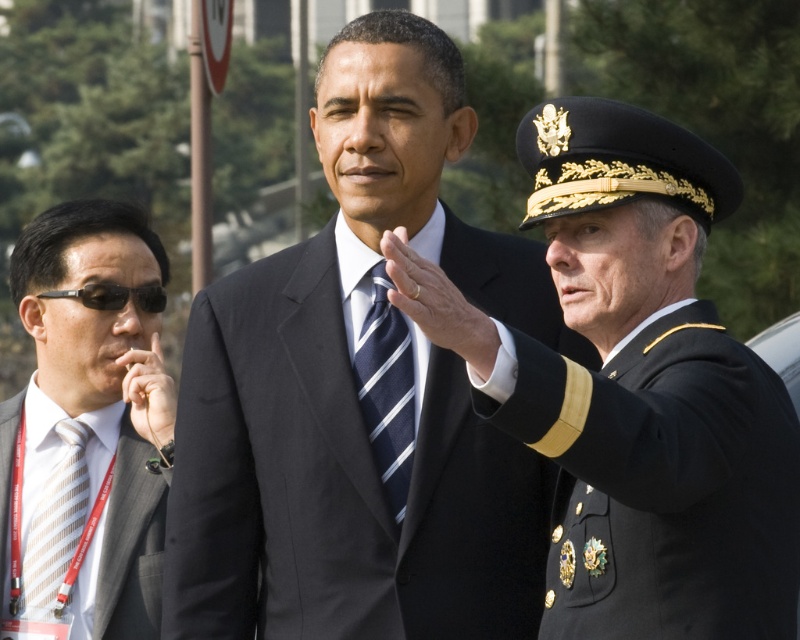
You are a photographer trying to position yourself to capture a photo of the matte black suit at center. According to the coordinates provided, where exactly should you aim your camera?

The matte black suit at center is located at point coordinates (366,388), so aim your camera precisely at those coordinates to capture the subject accurately.

You are a photographer trying to capture a group photo of the black military uniform at right and the blue striped tie at center. Since you want to ensure both subjects are in focus, you need to know which one is taller. Can you determine which is taller?

The black military uniform at right is taller than the blue striped tie at center, so you should adjust your camera settings to accommodate the height difference for proper focus.

You are planning to take a photo of the black military uniform at right and the gray striped suit at left. Which one should you zoom in on if you want to capture the taller individual?

The black military uniform at right is much taller than the gray striped suit at left, so you should zoom in on the black military uniform at right to capture the taller individual.